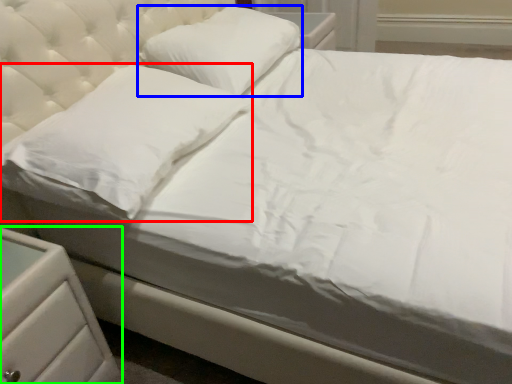
Question: Which object is the closest to the pillow (highlighted by a red box)? Choose among these: pillow (highlighted by a blue box) or nightstand (highlighted by a green box).

Choices:
 (A) pillow
 (B) nightstand

Answer: (B)